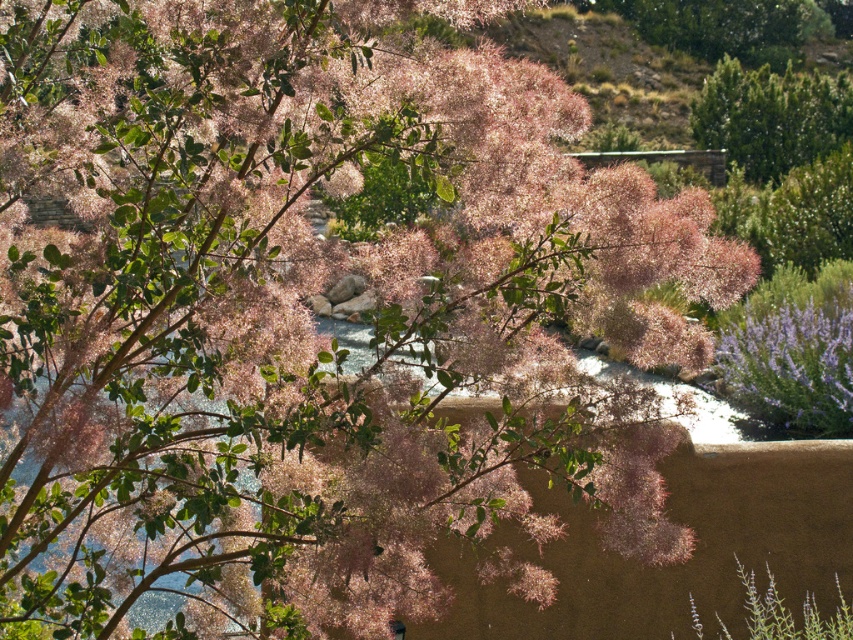
Consider the image. Does purple fuzzy bush at lower right have a larger size compared to green matte bush at upper right?

Yes.

Does purple fuzzy bush at lower right appear on the left side of green matte bush at upper right?

Correct, you'll find purple fuzzy bush at lower right to the left of green matte bush at upper right.

Between point (836, 413) and point (828, 100), which one is positioned in front?

Point (836, 413) is more forward.

The height and width of the screenshot is (640, 853). I want to click on purple fuzzy bush at lower right, so click(x=793, y=364).